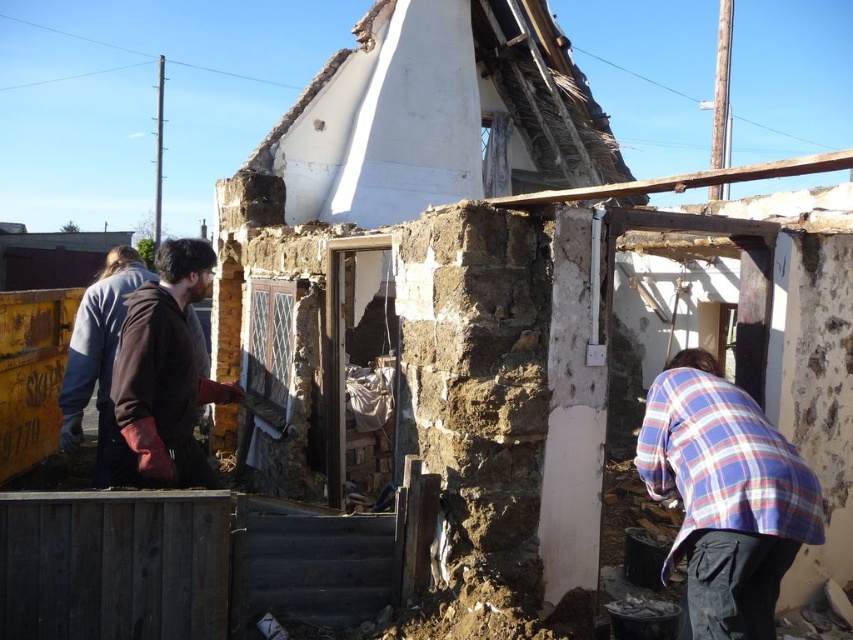
You are a safety inspector at the construction site. You need to ensure workers are maintaining a safe distance of at least 3 feet apart for safety. Are the workers wearing brown leather jacket at left and dark blue jacket at left following this rule?

The brown leather jacket at left is 27.97 inches from dark blue jacket at left. Since 27.97 inches is less than 36 inches, which is 3 feet, the workers are not maintaining the required safe distance.

You are a safety inspector assessing the construction site. You notice two workers wearing the plaid fabric shirt at lower right and the brown leather jacket at left. Which worker is wearing clothing with a narrower width?

The plaid fabric shirt at lower right has a lesser width compared to the brown leather jacket at left, so the worker in the plaid fabric shirt at lower right is wearing clothing with a narrower width.

You are standing at the construction site and want to know which of the two points, point (137, 298) or point (67, 401), is closer to you. Can you determine this based on their positions?

Point (137, 298) is closer to the viewer than point (67, 401).